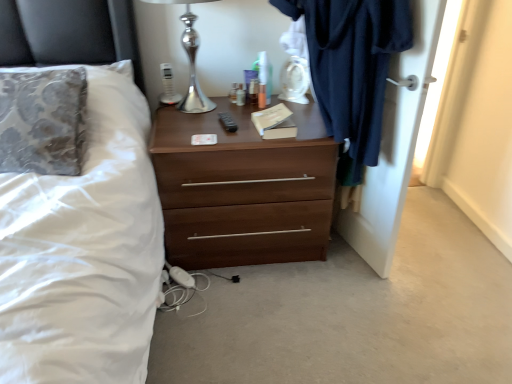
Question: Visually, is silver metallic table lamp at upper center positioned to the left or to the right of brown wood chest of drawers at center?

Choices:
 (A) left
 (B) right

Answer: (A)

Question: From a real-world perspective, is silver metallic table lamp at upper center above or below brown wood chest of drawers at center?

Choices:
 (A) below
 (B) above

Answer: (B)

Question: Which object is the closest to the white fabric bed at left?

Choices:
 (A) dark blue fabric at right
 (B) dark blue fabric at right
 (C) brown wood chest of drawers at center
 (D) silver metallic table lamp at upper center

Answer: (C)

Question: Estimate the real-world distances between objects in this image. Which object is farther from the brown wood chest of drawers at center?

Choices:
 (A) silver metallic table lamp at upper center
 (B) white fabric bed at left
 (C) dark blue fabric at right
 (D) dark blue fabric at right

Answer: (A)